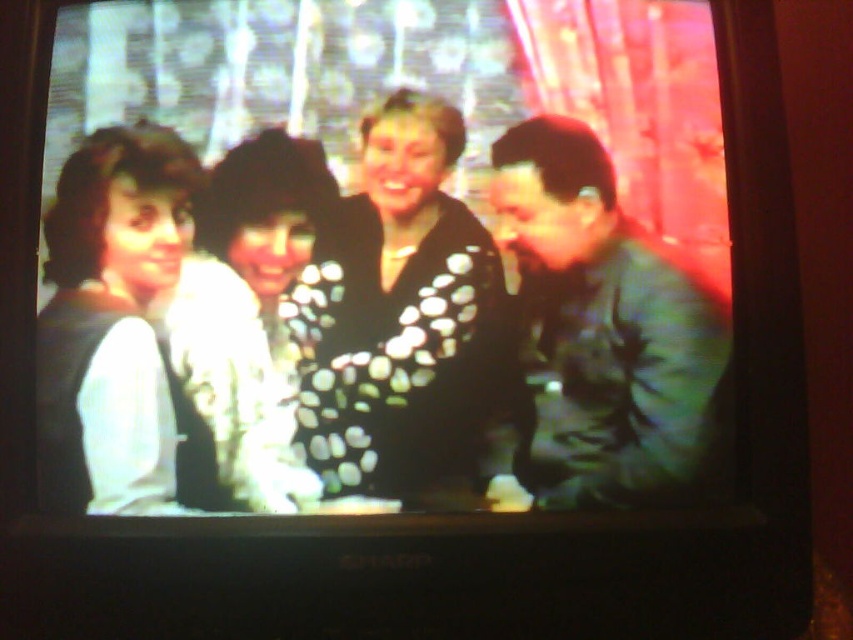
Question: Which object is closer to the camera taking this photo?

Choices:
 (A) black matte vest at left
 (B) black dotted sweater at center
 (C) green matte jacket at right
 (D) white dotted sweater at center

Answer: (B)

Question: Among these objects, which one is nearest to the camera?

Choices:
 (A) black dotted sweater at center
 (B) green matte jacket at right

Answer: (A)

Question: Is black dotted sweater at center smaller than white dotted sweater at center?

Choices:
 (A) no
 (B) yes

Answer: (A)

Question: Which object is the farthest from the black dotted sweater at center?

Choices:
 (A) matte black sweater at center
 (B) white dotted sweater at center

Answer: (A)

Question: Is matte black sweater at center further to the viewer compared to black dotted sweater at center?

Choices:
 (A) yes
 (B) no

Answer: (A)

Question: Does green matte jacket at right lie in front of black matte vest at left?

Choices:
 (A) no
 (B) yes

Answer: (A)